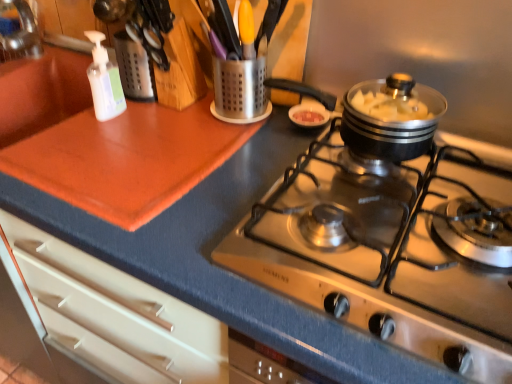
Question: In terms of size, does stainless steel cooktop at center appear bigger or smaller than white translucent bottle at upper left?

Choices:
 (A) small
 (B) big

Answer: (B)

Question: From a real-world perspective, is stainless steel cooktop at center physically located above or below white translucent bottle at upper left?

Choices:
 (A) above
 (B) below

Answer: (B)

Question: Estimate the real-world distances between objects in this image. Which object is farther from the white translucent bottle at upper left?

Choices:
 (A) stainless steel cooktop at center
 (B) metallic utensil holder at upper center

Answer: (A)

Question: Considering the real-world distances, which object is closest to the metallic utensil holder at upper center?

Choices:
 (A) stainless steel cooktop at center
 (B) white translucent bottle at upper left

Answer: (B)